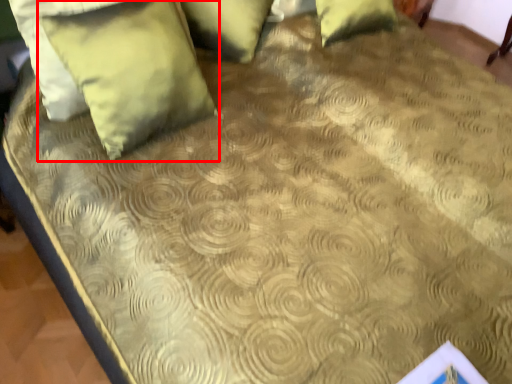
Question: Where is pillow (annotated by the red box) located in relation to pillow in the image?

Choices:
 (A) left
 (B) right

Answer: (A)